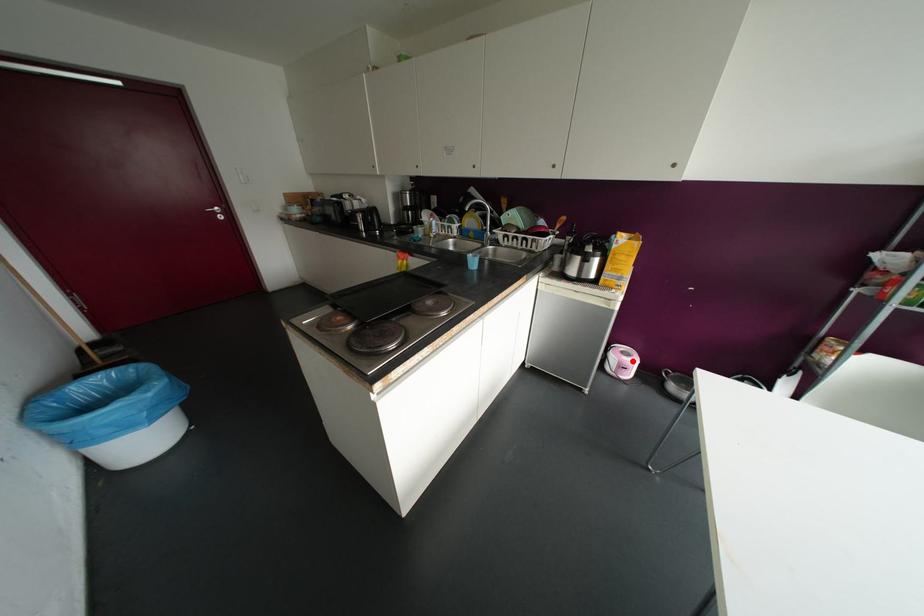
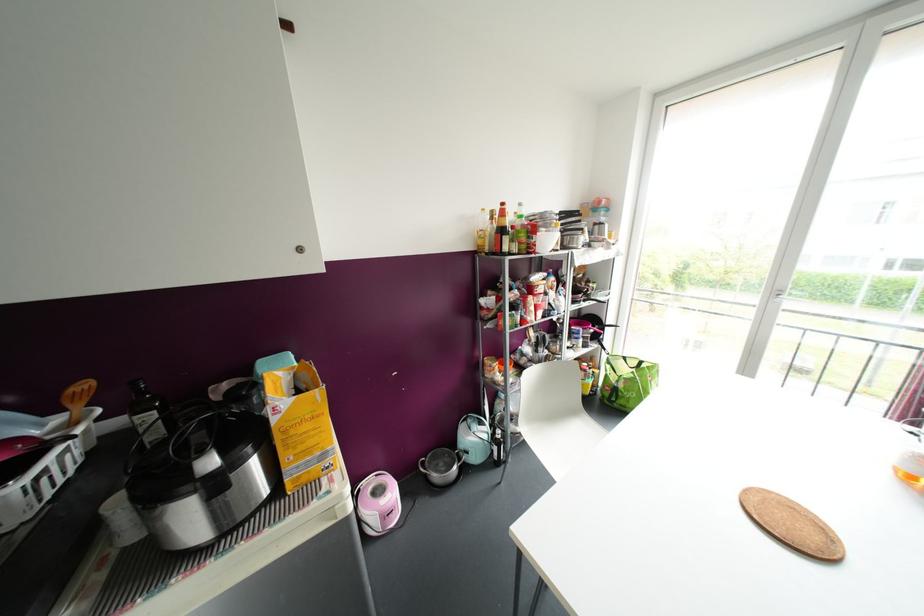
Question: I am providing you with two images of the same scene from different viewpoints. In image1, a red point is highlighted. Considering the same 3D point in image2, which of the following is correct?

Choices:
 (A) It is closer
 (B) It is farther

Answer: (A)